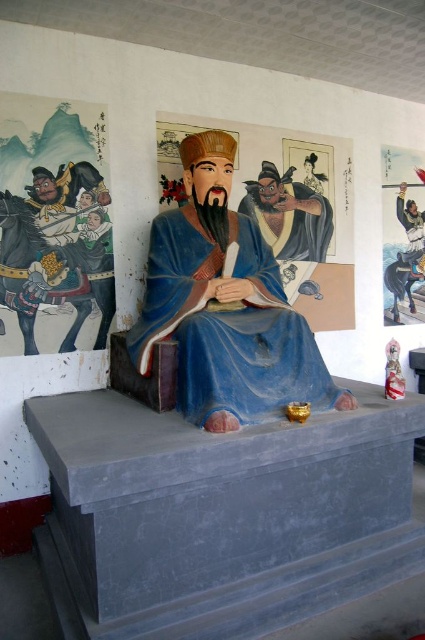
You are a tour guide explaining the statue to visitors. Pointing to the blue matte robe at center and the matte blue statue at center, you want to clarify their spatial relationship. Which one is positioned lower in the image?

The blue matte robe at center is located below the matte blue statue at center, so the blue matte robe at center is positioned lower in the image.

You are an art conservator assessing the dimensions of the statue and its robe. Given that the statue is on a pedestal, can you determine if the blue matte robe at center extends wider than the matte blue statue at center?

The blue matte robe at center is wider than the matte blue statue at center according to the description.

You are a tourist visiting the statue and want to take a photo of the blue matte robe at center and the matte blue statue at center. Which one should you focus on first to ensure both are in the frame?

The blue matte robe at center is in front of the matte blue statue at center, so you should focus on the matte blue statue at center first to ensure both are in the frame.